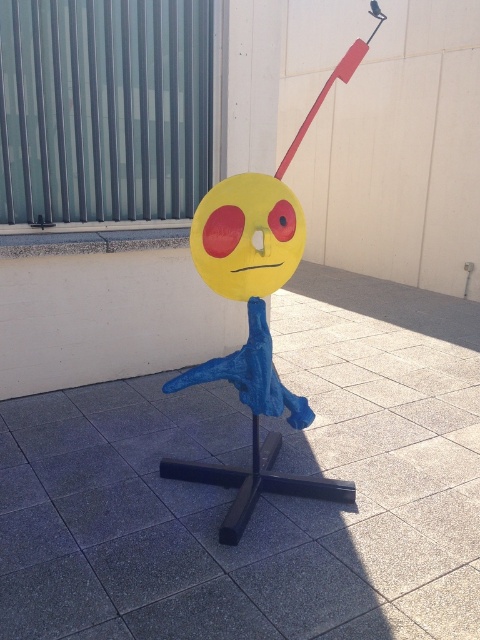
You are an artist trying to decide which material to use for a sculpture. You have two options in the image, the yellow matte face at center and the yellow paper face at center. Which one is bigger in size?

The yellow matte face at center is larger in size compared to the yellow paper face at center.

Please provide the coordinates of the yellow matte face at center in the image.

The coordinates of the yellow matte face at center are at point (x=256, y=316).